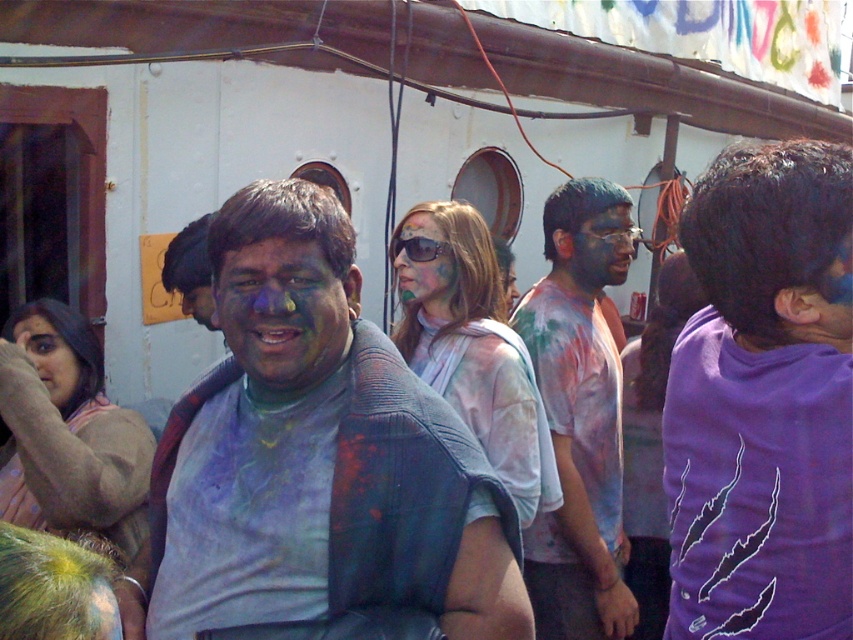
Which is behind, point (335, 364) or point (502, 273)?

Point (502, 273)

Is point (314, 244) less distant than point (508, 305)?

That is True.

Find the location of a particular element. The width and height of the screenshot is (853, 640). matte paint face at center is located at coordinates (283, 312).

Locate an element on the screen. matte paint face at center is located at coordinates (283, 312).

How much distance is there between multicolored paint-covered shirt at center and matte paint face at center?

multicolored paint-covered shirt at center and matte paint face at center are 1.45 meters apart.

Locate an element on the screen. This screenshot has height=640, width=853. multicolored paint-covered shirt at center is located at coordinates (579, 413).

Between multicolored paint-covered shirt at center and matte blue face at center, which one is positioned higher?

matte blue face at center is above.

Is point (587, 422) closer to camera compared to point (596, 243)?

That is True.

Does point (619, 577) come closer to viewer compared to point (598, 273)?

Yes, point (619, 577) is in front of point (598, 273).

This screenshot has width=853, height=640. I want to click on multicolored paint-covered shirt at center, so click(x=579, y=413).